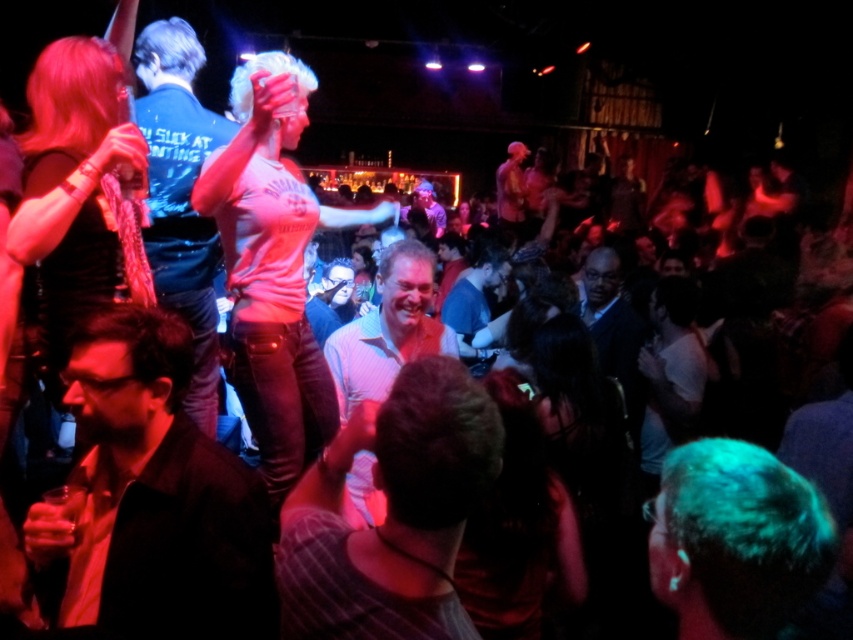
Does point (202, 545) lie in front of point (78, 90)?

That is True.

Between point (96, 477) and point (109, 230), which one is positioned behind?

Positioned behind is point (109, 230).

At what (x,y) coordinates should I click in order to perform the action: click on dark brown leather jacket at lower left. Please return your answer as a coordinate pair (x, y). The width and height of the screenshot is (853, 640). Looking at the image, I should click on (154, 496).

Does dark brown leather jacket at lower left appear on the right side of blonde synthetic wig at center?

In fact, dark brown leather jacket at lower left is to the left of blonde synthetic wig at center.

Who is more forward, (167, 557) or (403, 248)?

Point (167, 557) is in front.

The height and width of the screenshot is (640, 853). I want to click on dark brown leather jacket at lower left, so click(x=154, y=496).

Measure the distance between shiny metallic shirt at center and camera.

A distance of 29.23 feet exists between shiny metallic shirt at center and camera.

Find the location of a particular element. Image resolution: width=853 pixels, height=640 pixels. shiny metallic shirt at center is located at coordinates (511, 189).